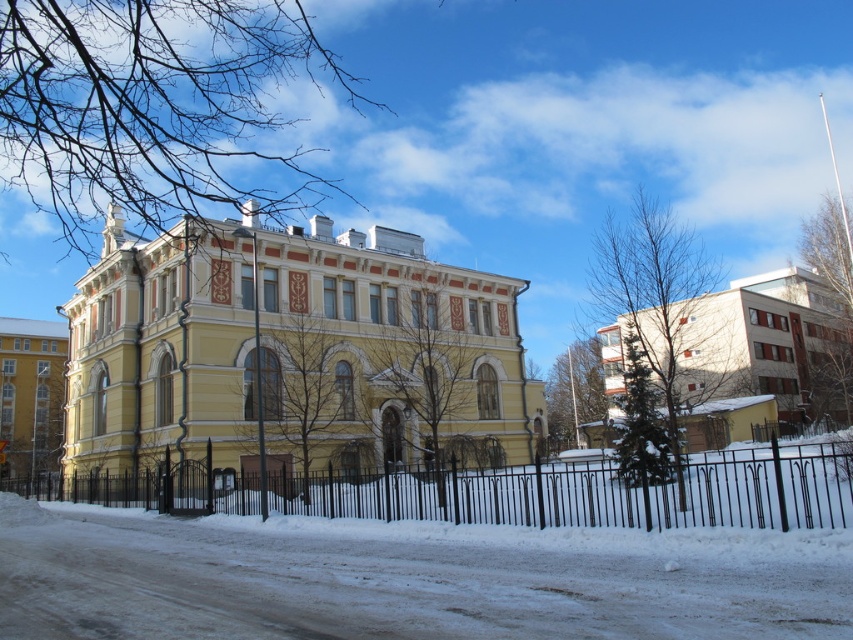
Is point (233, 317) less distant than point (811, 298)?

Yes.

The width and height of the screenshot is (853, 640). In order to click on yellow matte building at center in this screenshot , I will do `click(291, 352)`.

The height and width of the screenshot is (640, 853). Find the location of `yellow matte building at center`. yellow matte building at center is located at coordinates (291, 352).

The width and height of the screenshot is (853, 640). Identify the location of yellow matte building at center. (291, 352).

Who is lower down, yellow matte building at center or black wrought iron fence at lower center?

black wrought iron fence at lower center

Find the location of `yellow matte building at center`. yellow matte building at center is located at coordinates (291, 352).

Locate an element on the screen. This screenshot has height=640, width=853. yellow matte building at center is located at coordinates (291, 352).

The image size is (853, 640). Find the location of `yellow matte building at center`. yellow matte building at center is located at coordinates (291, 352).

Between yellow matte building at center and yellow stone building at left, which one appears on the right side from the viewer's perspective?

yellow matte building at center is more to the right.

Looking at this image, is yellow matte building at center taller than yellow stone building at left?

Yes, yellow matte building at center is taller than yellow stone building at left.

This screenshot has width=853, height=640. What do you see at coordinates (291, 352) in the screenshot? I see `yellow matte building at center` at bounding box center [291, 352].

You are a GUI agent. You are given a task and a screenshot of the screen. Output one action in this format:
    pyautogui.click(x=<x>, y=<y>)
    Task: Click on the yellow matte building at center
    
    Given the screenshot: What is the action you would take?
    click(x=291, y=352)